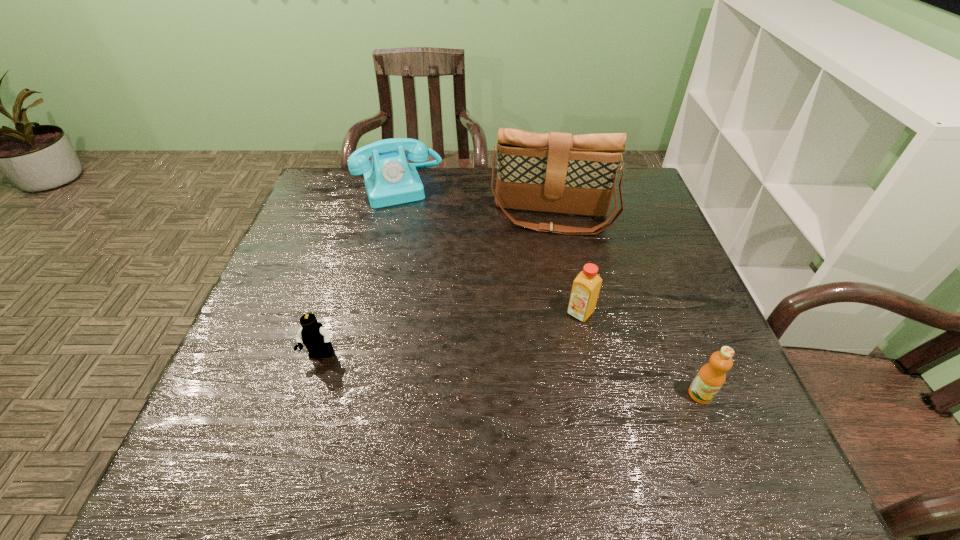
This screenshot has width=960, height=540. Find the location of `vacant space at the left edge`. vacant space at the left edge is located at coordinates (270, 313).

I want to click on free space at the right edge of the desktop, so click(658, 282).

This screenshot has width=960, height=540. Find the location of `vacant space that's between the third nearest object and the nearest object`. vacant space that's between the third nearest object and the nearest object is located at coordinates (640, 354).

At what (x,y) coordinates should I click in order to perform the action: click on vacant space that's between the telephone and the farther orange juice. Please return your answer as a coordinate pair (x, y). The width and height of the screenshot is (960, 540). Looking at the image, I should click on (490, 250).

The image size is (960, 540). Find the location of `free space between the telephone and the left orange juice`. free space between the telephone and the left orange juice is located at coordinates [490, 250].

Find the location of `vacant area that lies between the farther orange juice and the telephone`. vacant area that lies between the farther orange juice and the telephone is located at coordinates (490, 250).

Image resolution: width=960 pixels, height=540 pixels. I want to click on free space between the rightmost object and the second nearest object, so click(x=511, y=375).

At what (x,y) coordinates should I click in order to perform the action: click on free area in between the left orange juice and the telephone. Please return your answer as a coordinate pair (x, y). Looking at the image, I should click on (490, 250).

At what (x,y) coordinates should I click in order to perform the action: click on free space between the right orange juice and the tallest object. Please return your answer as a coordinate pair (x, y). The image size is (960, 540). Looking at the image, I should click on (626, 306).

Where is `unoccupied position between the telephone and the rightmost object`? The height and width of the screenshot is (540, 960). unoccupied position between the telephone and the rightmost object is located at coordinates (550, 291).